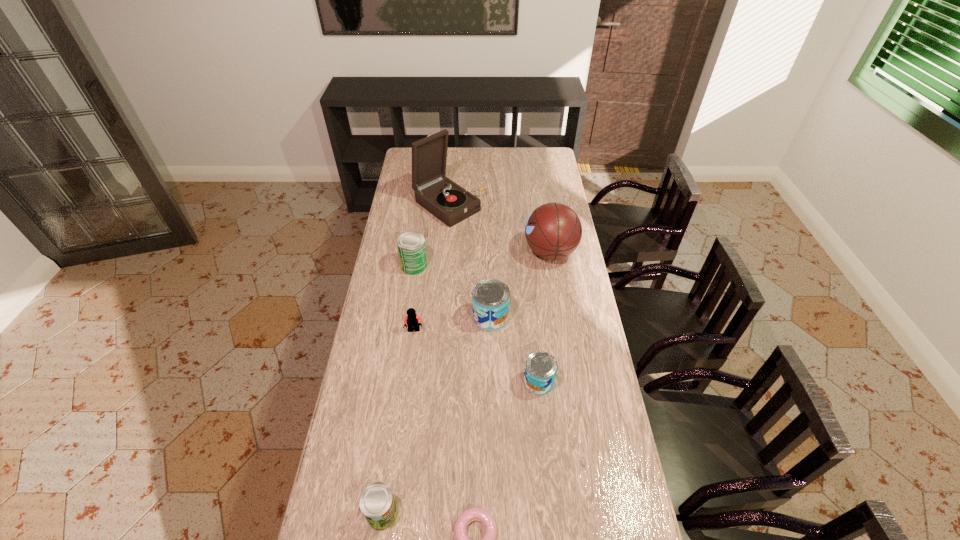
You are a GUI agent. You are given a task and a screenshot of the screen. Output one action in this format:
    pyautogui.click(x=<x>, y=<y>)
    Task: Click on the Lego that is positioned at the left edge
    The height and width of the screenshot is (540, 960).
    Given the screenshot: What is the action you would take?
    pyautogui.click(x=412, y=320)

Identify the location of object present at the right edge. point(553,231).

You are a GUI agent. You are given a task and a screenshot of the screen. Output one action in this format:
    pyautogui.click(x=<x>, y=<y>)
    Task: Click on the free spot at the far edge of the desktop
    
    Given the screenshot: What is the action you would take?
    pyautogui.click(x=507, y=152)

In the image, there is a desktop. Identify the location of vacant space at the left edge. Image resolution: width=960 pixels, height=540 pixels. (403, 347).

Where is `vacant space at the right edge of the desktop`? vacant space at the right edge of the desktop is located at coordinates (618, 469).

At what (x,y) coordinates should I click in order to perform the action: click on free location at the far left corner. Please return your answer as a coordinate pair (x, y). The image size is (960, 540). Looking at the image, I should click on (406, 156).

Find the location of a particular element. vacant area between the third can from left to right and the tallest object is located at coordinates (469, 261).

Identify the location of vacant area that lies between the bigger blue can and the smaller blue can. This screenshot has height=540, width=960. (515, 349).

This screenshot has width=960, height=540. Find the location of `unoccupied position between the farther green can and the basketball`. unoccupied position between the farther green can and the basketball is located at coordinates (482, 259).

Identify the location of empty location between the smaller blue can and the black Lego. Image resolution: width=960 pixels, height=540 pixels. (476, 356).